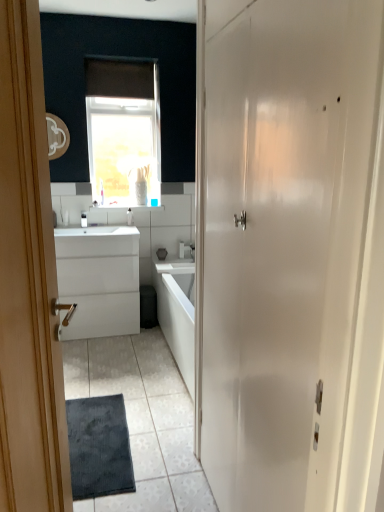
Where is `free spot behind dark gray textured bath mat at lower center`? This screenshot has width=384, height=512. free spot behind dark gray textured bath mat at lower center is located at coordinates (125, 390).